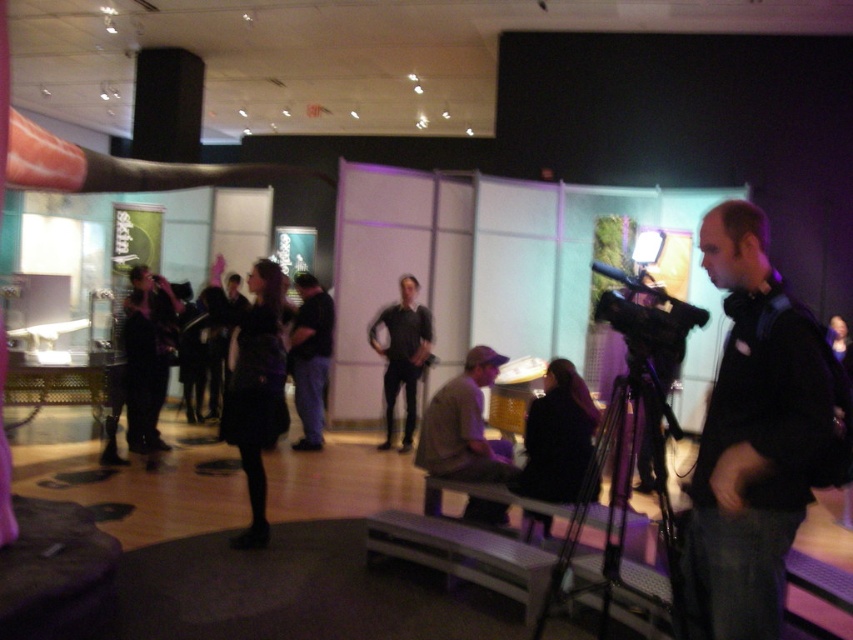
Based on the photo, you are a photographer standing in the museum. You need to take a photo that includes both the black matte jacket at right and the black matte shirt at center. Which one should you focus on first to ensure both are in frame?

The black matte jacket at right has a lesser height compared to the black matte shirt at center, so you should focus on the black matte shirt at center first to ensure both are in frame.

You are a photographer standing in the center of the museum. You need to take a photo of both the brown suede jacket at center and the matte black dress at center. Which one should you focus on first if you want to capture both in the same frame without moving the camera?

The brown suede jacket at center is below the matte black dress at center, so you should focus on the matte black dress at center first to ensure both are in the frame.